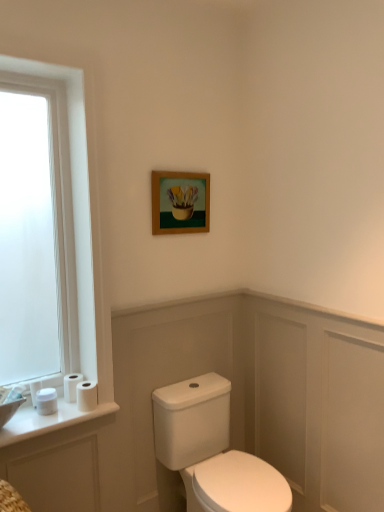
What is the approximate height of wooden frame at upper center?

wooden frame at upper center is 12.42 inches tall.

This screenshot has height=512, width=384. What are the coordinates of `white glossy counter top at lower left` in the screenshot? It's located at (48, 421).

Locate an element on the screen. The image size is (384, 512). white frosted glass window at left is located at coordinates (73, 194).

How much space does white matte toilet paper at lower left, which appears as the 1th toilet paper when viewed from the left, occupy horizontally?

It is 2.47 inches.

Where is `white glossy porcelain at center`? The height and width of the screenshot is (512, 384). white glossy porcelain at center is located at coordinates (212, 450).

Where is `wooden frame at upper center`? Image resolution: width=384 pixels, height=512 pixels. wooden frame at upper center is located at coordinates (180, 202).

Can you tell me how much white frosted glass window at left and wooden frame at upper center differ in facing direction?

They differ by 0.0589 degrees in their facing directions.

Is white frosted glass window at left looking in the opposite direction of wooden frame at upper center?

No, white frosted glass window at left's orientation is not away from wooden frame at upper center.

Considering the relative sizes of white frosted glass window at left and wooden frame at upper center in the image provided, is white frosted glass window at left taller than wooden frame at upper center?

Indeed, white frosted glass window at left has a greater height compared to wooden frame at upper center.

Is white frosted glass window at left beside wooden frame at upper center?

No, white frosted glass window at left is not beside wooden frame at upper center.

Considering the relative sizes of white matte toilet paper at lower left, acting as the second toilet paper starting from the right, and white frosted glass window at left in the image provided, is white matte toilet paper at lower left, acting as the second toilet paper starting from the right, thinner than white frosted glass window at left?

Correct, the width of white matte toilet paper at lower left, acting as the second toilet paper starting from the right, is less than that of white frosted glass window at left.

Considering the relative sizes of white matte toilet paper at lower left, acting as the second toilet paper starting from the right, and white frosted glass window at left in the image provided, is white matte toilet paper at lower left, acting as the second toilet paper starting from the right, smaller than white frosted glass window at left?

Yes, white matte toilet paper at lower left, acting as the second toilet paper starting from the right, is smaller than white frosted glass window at left.

Which is behind, point (79, 373) or point (78, 323)?

Point (79, 373)

Would you say white matte toilet paper at lower left, which ranks as the third toilet paper in left-to-right order, is to the left or to the right of white frosted glass window at left in the picture?

In the image, white matte toilet paper at lower left, which ranks as the third toilet paper in left-to-right order, appears on the right side of white frosted glass window at left.

Is point (256, 467) closer or farther from the camera than point (78, 402)?

Clearly, point (256, 467) is more distant from the camera than point (78, 402).

In terms of width, does white glossy porcelain at center look wider or thinner when compared to white matte toilet paper at lower left, acting as the 4th toilet paper starting from the left?

Clearly, white glossy porcelain at center has more width compared to white matte toilet paper at lower left, acting as the 4th toilet paper starting from the left.

Visually, is white glossy porcelain at center positioned to the left or to the right of white matte toilet paper at lower left, acting as the 4th toilet paper starting from the left?

From the image, it's evident that white glossy porcelain at center is to the right of white matte toilet paper at lower left, acting as the 4th toilet paper starting from the left.

Looking at this image, from the image's perspective, between white glossy porcelain at center and white matte toilet paper at lower left, positioned as the first toilet paper in right-to-left order, who is located below?

white glossy porcelain at center is shown below in the image.

From the picture: From a real-world perspective, is white matte toilet paper at lower left, the fourth toilet paper when ordered from right to left, positioned under wooden frame at upper center based on gravity?

Correct, in the physical world, white matte toilet paper at lower left, the fourth toilet paper when ordered from right to left, is lower than wooden frame at upper center.

Is white matte toilet paper at lower left, the fourth toilet paper when ordered from right to left, taller than wooden frame at upper center?

No.

Could wooden frame at upper center be considered to be inside white matte toilet paper at lower left, which appears as the 1th toilet paper when viewed from the left?

No, wooden frame at upper center is not inside white matte toilet paper at lower left, which appears as the 1th toilet paper when viewed from the left.

Is white matte toilet paper at lower left, acting as the 4th toilet paper starting from the left, closer to the viewer compared to white glossy sink at lower left?

That is False.

Can you confirm if white matte toilet paper at lower left, positioned as the first toilet paper in right-to-left order, is taller than white glossy sink at lower left?

Incorrect, the height of white matte toilet paper at lower left, positioned as the first toilet paper in right-to-left order, is not larger of that of white glossy sink at lower left.

From a real-world perspective, which toilet paper is the 2nd one underneath the white glossy sink at lower left? Please provide its 2D coordinates.

[(86, 395)]

Considering the positions of point (93, 396) and point (2, 413), is point (93, 396) closer or farther from the camera than point (2, 413)?

Point (93, 396) appears to be farther away from the viewer than point (2, 413).

Which is farther from the camera, (32, 386) or (10, 403)?

Positioned behind is point (32, 386).

Consider the image. Which object is closer to the camera taking this photo, white matte toilet paper at lower left, the fourth toilet paper when ordered from right to left, or white glossy sink at lower left?

white glossy sink at lower left is more forward.

From the image's perspective, is white matte toilet paper at lower left, which appears as the 1th toilet paper when viewed from the left, positioned above or below white glossy sink at lower left?

Based on their image positions, white matte toilet paper at lower left, which appears as the 1th toilet paper when viewed from the left, is located above white glossy sink at lower left.

Who is smaller, wooden frame at upper center or white matte toilet paper at lower left, the fourth toilet paper when ordered from right to left?

white matte toilet paper at lower left, the fourth toilet paper when ordered from right to left.

Would you say wooden frame at upper center contains white matte toilet paper at lower left, which appears as the 1th toilet paper when viewed from the left?

That's incorrect, white matte toilet paper at lower left, which appears as the 1th toilet paper when viewed from the left, is not inside wooden frame at upper center.

From a real-world perspective, which is physically above, wooden frame at upper center or white matte toilet paper at lower left, the fourth toilet paper when ordered from right to left?

In real-world perspective, wooden frame at upper center is above.

Is white matte toilet paper at lower left, the fourth toilet paper when ordered from right to left, at the back of wooden frame at upper center?

wooden frame at upper center is not turned away from white matte toilet paper at lower left, the fourth toilet paper when ordered from right to left.

At what (x,y) coordinates should I click in order to perform the action: click on window below the wooden frame at upper center (from a real-world perspective). Please return your answer as a coordinate pair (x, y). The width and height of the screenshot is (384, 512). Looking at the image, I should click on (73, 194).

You are a GUI agent. You are given a task and a screenshot of the screen. Output one action in this format:
    pyautogui.click(x=<x>, y=<y>)
    Task: Click on the window that appears in front of the white matte toilet paper at lower left, which ranks as the third toilet paper in left-to-right order
    This screenshot has width=384, height=512.
    Given the screenshot: What is the action you would take?
    pyautogui.click(x=73, y=194)

Considering their positions, is white matte toilet paper at lower left, which appears as the 1th toilet paper when viewed from the left, positioned closer to wooden frame at upper center than white frosted glass window at left?

white frosted glass window at left.

Considering their positions, is white frosted glass window at left positioned closer to white matte toilet paper at lower left, acting as the second toilet paper starting from the right, than wooden frame at upper center?

Among the two, white frosted glass window at left is located nearer to white matte toilet paper at lower left, acting as the second toilet paper starting from the right.

From the image, which object appears to be nearer to white matte toilet paper at lower left, arranged as the third toilet paper when viewed from the right, white frosted glass window at left or wooden frame at upper center?

white frosted glass window at left.

Based on their spatial positions, is white matte toilet paper at lower left, arranged as the third toilet paper when viewed from the right, or white glossy sink at lower left closer to white glossy porcelain at center?

Based on the image, white matte toilet paper at lower left, arranged as the third toilet paper when viewed from the right, appears to be nearer to white glossy porcelain at center.

Based on the photo, which object lies further to the anchor point white matte toilet paper at lower left, acting as the 4th toilet paper starting from the left, white glossy counter top at lower left or wooden frame at upper center?

Among the two, wooden frame at upper center is located further to white matte toilet paper at lower left, acting as the 4th toilet paper starting from the left.

Based on their spatial positions, is white glossy counter top at lower left or white frosted glass window at left further from white glossy porcelain at center?

Based on the image, white frosted glass window at left appears to be further to white glossy porcelain at center.

Considering their positions, is white matte toilet paper at lower left, the second toilet paper positioned from the left, positioned closer to white matte toilet paper at lower left, acting as the second toilet paper starting from the right, than white matte toilet paper at lower left, positioned as the first toilet paper in right-to-left order?

Among the two, white matte toilet paper at lower left, positioned as the first toilet paper in right-to-left order, is located nearer to white matte toilet paper at lower left, acting as the second toilet paper starting from the right.

Looking at the image, which one is located further to wooden frame at upper center, white frosted glass window at left or white glossy sink at lower left?

The object further to wooden frame at upper center is white glossy sink at lower left.

At what (x,y) coordinates should I click in order to perform the action: click on toilet paper between white matte toilet paper at lower left, which ranks as the third toilet paper in left-to-right order, and white glossy porcelain at center. Please return your answer as a coordinate pair (x, y). This screenshot has width=384, height=512. Looking at the image, I should click on (86, 395).

Find the location of a particular element. counter top between white matte toilet paper at lower left, which appears as the 1th toilet paper when viewed from the left, and white glossy porcelain at center from left to right is located at coordinates (48, 421).

At what (x,y) coordinates should I click in order to perform the action: click on sink between wooden frame at upper center and white glossy porcelain at center vertically. Please return your answer as a coordinate pair (x, y). The width and height of the screenshot is (384, 512). Looking at the image, I should click on tap(9, 403).

The image size is (384, 512). I want to click on window between wooden frame at upper center and white glossy sink at lower left vertically, so point(73,194).